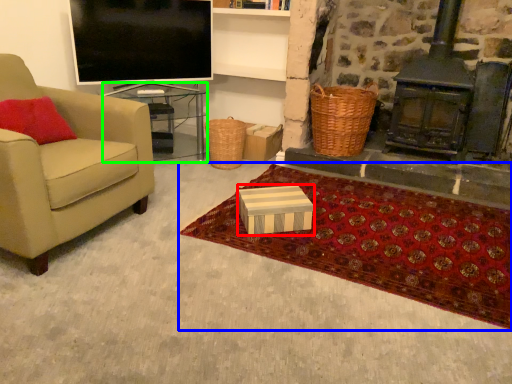
Question: Which object is positioned closest to box (highlighted by a red box)? Select from mat (highlighted by a blue box) and table (highlighted by a green box).

Choices:
 (A) mat
 (B) table

Answer: (A)